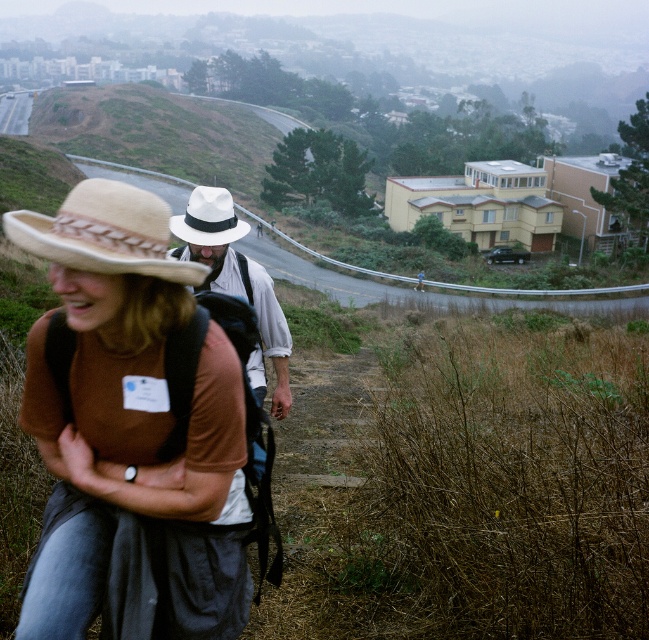
Question: Which of the following is the farthest from the observer?

Choices:
 (A) (119, 202)
 (B) (186, 256)
 (C) (223, 609)
 (D) (630, 310)

Answer: (D)

Question: Is gravel road at center bigger than white felt fedora at center?

Choices:
 (A) yes
 (B) no

Answer: (A)

Question: Can you confirm if gravel road at center is positioned to the right of white felt fedora at center?

Choices:
 (A) yes
 (B) no

Answer: (B)

Question: Can you confirm if matte brown shirt at center is bigger than white felt fedora at center?

Choices:
 (A) yes
 (B) no

Answer: (B)

Question: Estimate the real-world distances between objects in this image. Which object is farther from the matte brown shirt at center?

Choices:
 (A) white felt cowboy hat at center
 (B) white felt fedora at center

Answer: (B)

Question: Which object is positioned farthest from the matte brown shirt at center?

Choices:
 (A) white felt fedora at center
 (B) gravel road at center
 (C) beige straw cowboy hat at center
 (D) white felt cowboy hat at center

Answer: (B)